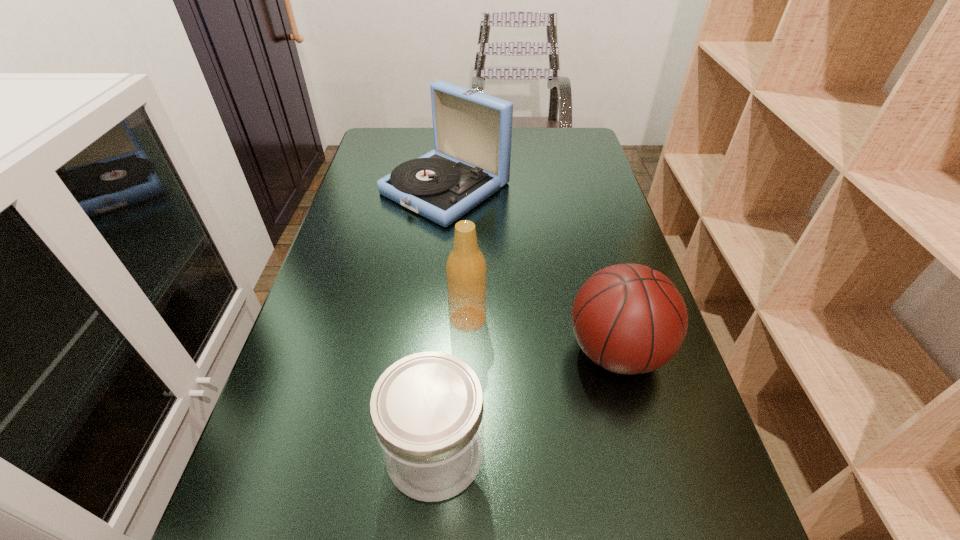
At what (x,y) coordinates should I click in order to perform the action: click on free spot between the rightmost object and the beer bottle. Please return your answer as a coordinate pair (x, y). Looking at the image, I should click on (542, 335).

The width and height of the screenshot is (960, 540). Find the location of `free space that is in between the basketball and the jar`. free space that is in between the basketball and the jar is located at coordinates (526, 402).

Where is `free spot between the basketball and the beer bottle`? The width and height of the screenshot is (960, 540). free spot between the basketball and the beer bottle is located at coordinates 542,335.

Identify the location of vacant space that is in between the basketball and the phonograph record. (531, 270).

The height and width of the screenshot is (540, 960). What are the coordinates of `vacant region between the farthest object and the shortest object` in the screenshot? It's located at (441, 320).

Identify the location of free space between the phonograph record and the nearest object. Image resolution: width=960 pixels, height=540 pixels. (441, 320).

You are a GUI agent. You are given a task and a screenshot of the screen. Output one action in this format:
    pyautogui.click(x=<x>, y=<y>)
    Task: Click on the vacant area that lies between the beer bottle and the rightmost object
    The width and height of the screenshot is (960, 540).
    Given the screenshot: What is the action you would take?
    pyautogui.click(x=542, y=335)

Locate an element on the screen. This screenshot has height=540, width=960. object that ranks as the third closest to the beer bottle is located at coordinates (472, 131).

Identify which object is located as the nearest to the beer bottle. Please provide its 2D coordinates. Your answer should be formatted as a tuple, i.e. [(x, y)], where the tuple contains the x and y coordinates of a point satisfying the conditions above.

[(630, 319)]

The height and width of the screenshot is (540, 960). I want to click on free spot that satisfies the following two spatial constraints: 1. on the back side of the nearest object; 2. on the left side of the beer bottle, so click(x=445, y=319).